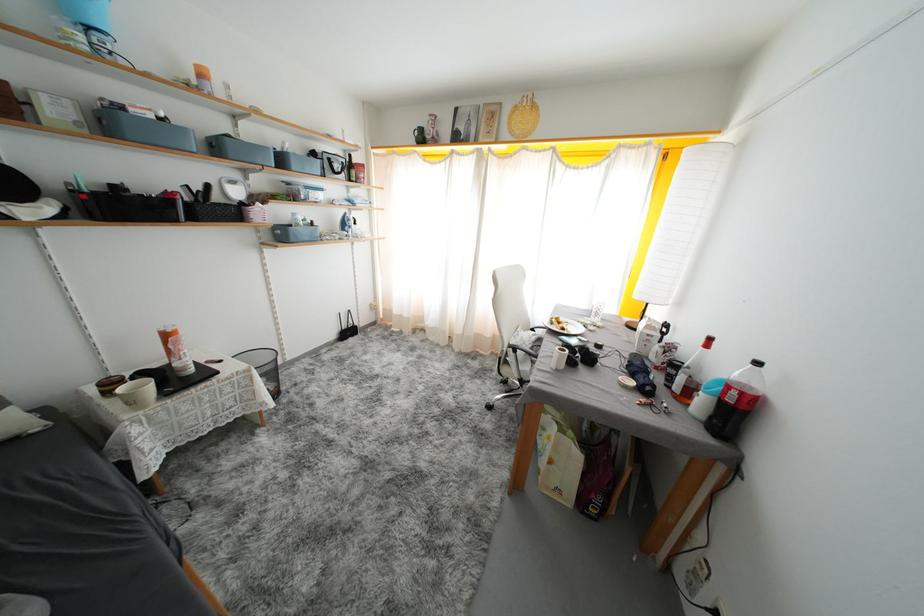
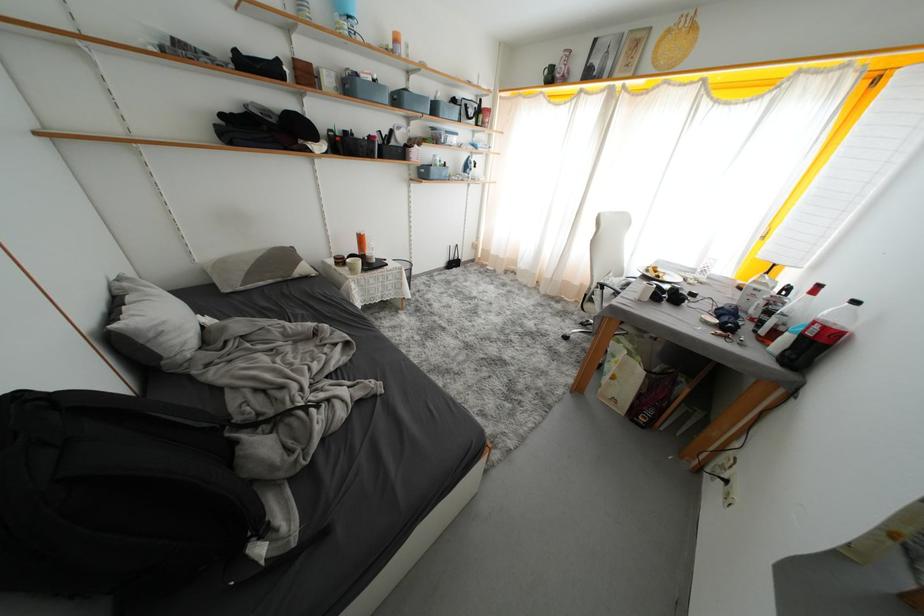
In the second image, find the point that corresponds to point (654, 339) in the first image.

(761, 293)